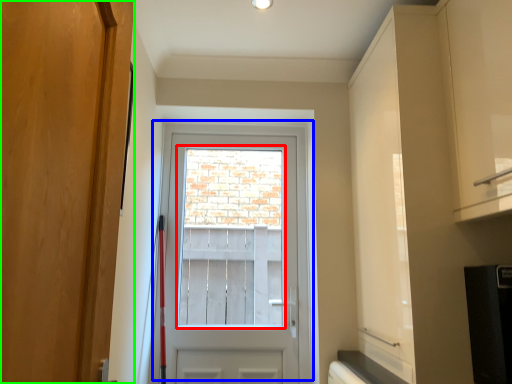
Question: Considering the real-world distances, which object is closest to window screen (highlighted by a red box)? door (highlighted by a blue box) or door (highlighted by a green box).

Choices:
 (A) door
 (B) door

Answer: (A)